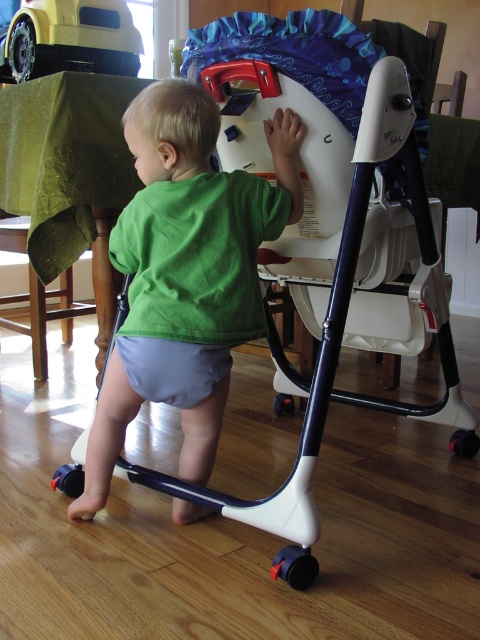
You are a parent trying to decide which item to hand to the child first. The green fabric shirt at center is currently on the child, and the yellow matte toy car at upper left is on the table. Which item is larger?

The green fabric shirt at center is bigger than the yellow matte toy car at upper left, so the shirt is larger.

From the picture: Where is the green fabric shirt at center located in the image?

The green fabric shirt at center is located at point (200,240) in the image.

You are a parent trying to ensure your child reaches the yellow matte toy car at upper left. The child is currently wearing the green fabric shirt at center. Based on their positions, can the child reach the toy without moving?

The green fabric shirt at center is located below the yellow matte toy car at upper left, meaning the child is positioned lower than the toy. Since the toy is on a higher surface, the child may need to stand on the walker to reach it.